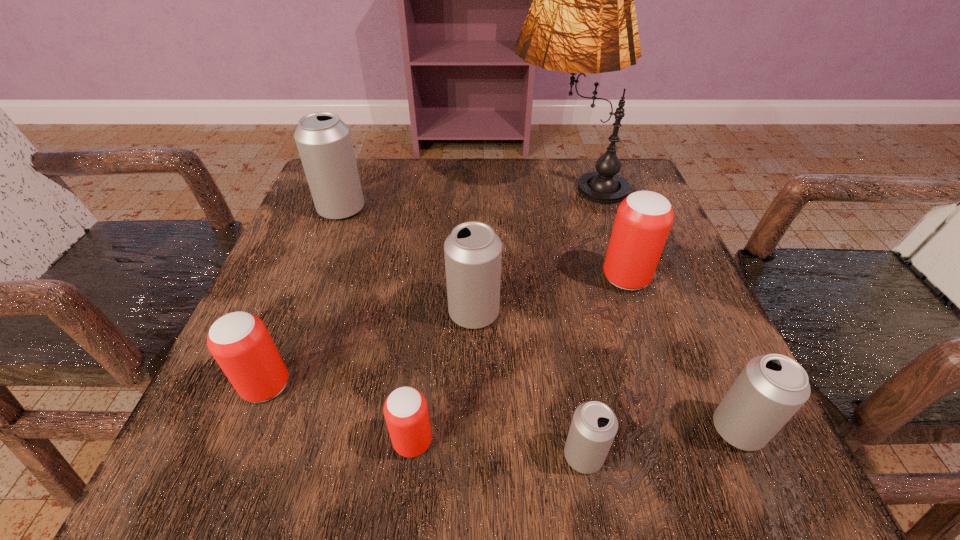
At what (x,y) coordinates should I click in order to perform the action: click on the rightmost beer can. Please return your answer as a coordinate pair (x, y). The height and width of the screenshot is (540, 960). Looking at the image, I should click on (771, 388).

This screenshot has width=960, height=540. I want to click on the smallest red beer can, so 405,410.

This screenshot has height=540, width=960. I want to click on the nearest red beer can, so click(405, 410).

At what (x,y) coordinates should I click in order to perform the action: click on the smallest white beer can. Please return your answer as a coordinate pair (x, y). Looking at the image, I should click on (594, 425).

Where is `the fifth beer can from left to right`? the fifth beer can from left to right is located at coordinates (594, 425).

You are a GUI agent. You are given a task and a screenshot of the screen. Output one action in this format:
    pyautogui.click(x=<x>, y=<y>)
    Task: Click on the free space located on the front-facing side of the tallest object
    The width and height of the screenshot is (960, 540).
    Given the screenshot: What is the action you would take?
    pyautogui.click(x=486, y=185)

Locate an element on the screen. This screenshot has width=960, height=540. vacant space located on the front-facing side of the tallest object is located at coordinates (443, 185).

You are a GUI agent. You are given a task and a screenshot of the screen. Output one action in this format:
    pyautogui.click(x=<x>, y=<y>)
    Task: Click on the vacant space located on the front-facing side of the tallest object
    The width and height of the screenshot is (960, 540).
    Given the screenshot: What is the action you would take?
    pyautogui.click(x=350, y=185)

This screenshot has height=540, width=960. Find the location of `free spot located on the right of the tallest beer can`. free spot located on the right of the tallest beer can is located at coordinates (552, 209).

At what (x,y) coordinates should I click in order to perform the action: click on free space located on the back of the rightmost red beer can. Please return your answer as a coordinate pair (x, y). Looking at the image, I should click on (604, 214).